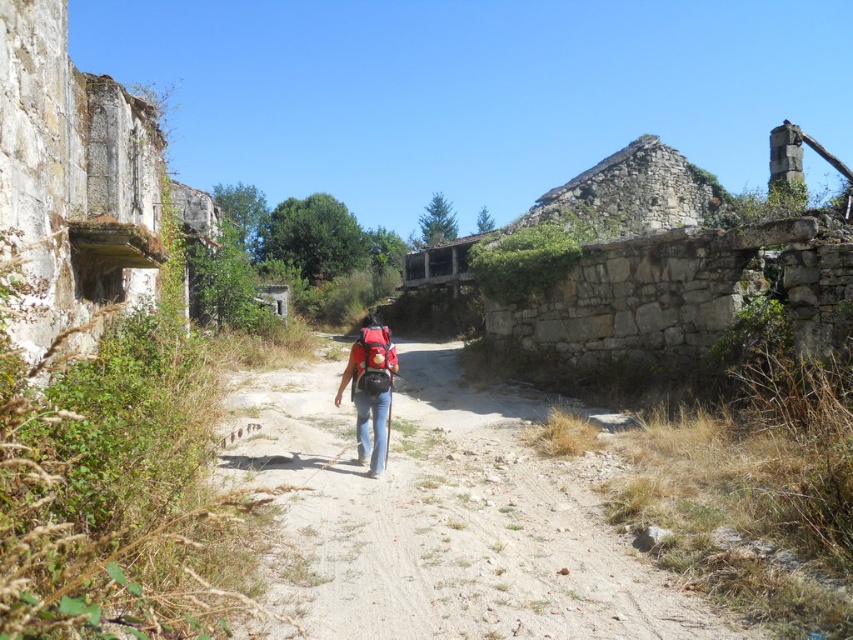
Question: Which of these objects is positioned farthest from the dusty gravel path at center?

Choices:
 (A) matte black backpack at center
 (B) red backpack at center

Answer: (A)

Question: Which point appears closest to the camera in this image?

Choices:
 (A) (358, 451)
 (B) (410, 573)
 (C) (378, 340)

Answer: (B)

Question: Is dusty gravel path at center wider than matte black backpack at center?

Choices:
 (A) no
 (B) yes

Answer: (B)

Question: Which object is closer to the camera taking this photo?

Choices:
 (A) matte black backpack at center
 (B) dusty gravel path at center
 (C) red backpack at center

Answer: (B)

Question: Does dusty gravel path at center appear under matte black backpack at center?

Choices:
 (A) no
 (B) yes

Answer: (B)

Question: Is red backpack at center positioned behind matte black backpack at center?

Choices:
 (A) no
 (B) yes

Answer: (B)